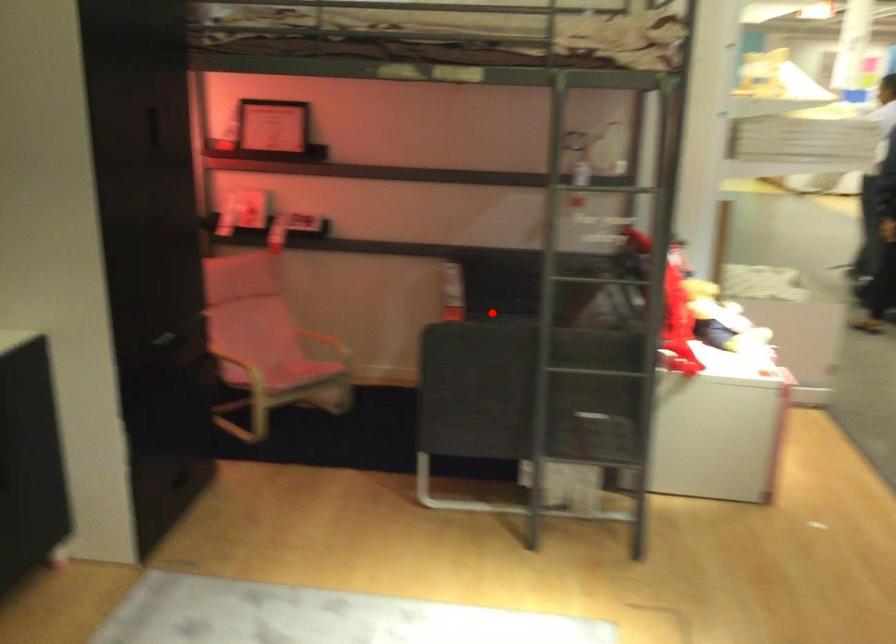
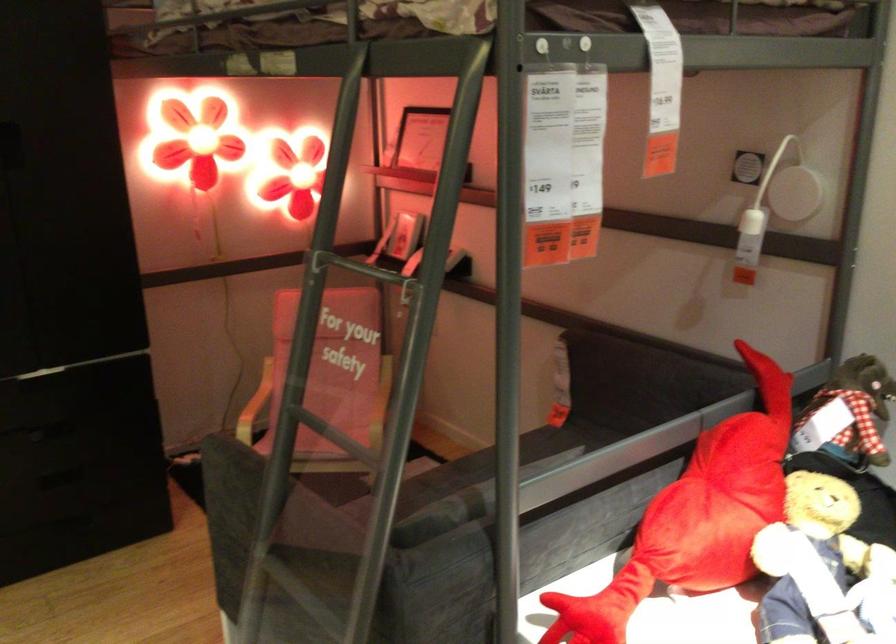
Question: A red point is marked in image1. In image2, is the corresponding 3D point closer to the camera or farther? Reply with the corresponding letter.

Choices:
 (A) The corresponding 3D point is closer.
 (B) The corresponding 3D point is farther.

Answer: (A)